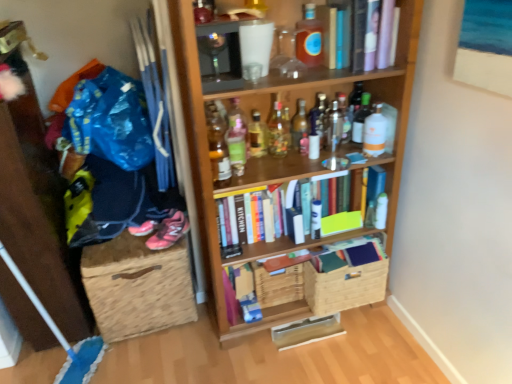
I want to click on translucent amber bottle at upper center, the sixth bottle when ordered from right to left, so click(x=310, y=38).

In order to click on clear glass bottle at center, the fifth bottle when ordered from right to left in this screenshot , I will do `click(318, 116)`.

What do you see at coordinates (241, 294) in the screenshot?
I see `hardcover book at center, the 1th book ordered from the bottom` at bounding box center [241, 294].

In order to face woven brown basket at lower center, the first basket when ordered from right to left, should I rotate leftwards or rightwards?

You should look right and rotate roughly 11.836 degrees.

Locate an element on the screen. This screenshot has width=512, height=384. clear glass bottle at upper center, placed as the 3th bottle when sorted from right to left is located at coordinates (344, 117).

Identify the location of translucent amber bottle at upper center, marked as the 6th bottle in a left-to-right arrangement. The image size is (512, 384). (310, 38).

Who is taller, clear glass bottle at center, the fifth bottle when ordered from right to left, or wooden crate at center, which is the second basket in right-to-left order?

wooden crate at center, which is the second basket in right-to-left order, is taller.

Is clear glass bottle at center, the fifth bottle when ordered from right to left, outside of wooden crate at center, which is the second basket in right-to-left order?

Yes, clear glass bottle at center, the fifth bottle when ordered from right to left, is outside of wooden crate at center, which is the second basket in right-to-left order.

Considering the relative sizes of clear glass bottle at center, the fifth bottle when ordered from right to left, and wooden crate at center, positioned as the 1th basket in left-to-right order, in the image provided, is clear glass bottle at center, the fifth bottle when ordered from right to left, wider than wooden crate at center, positioned as the 1th basket in left-to-right order,?

In fact, clear glass bottle at center, the fifth bottle when ordered from right to left, might be narrower than wooden crate at center, positioned as the 1th basket in left-to-right order.

What's the angular difference between hardcover books at center, the second book in the bottom-to-top sequence, and translucent plastic bottle at center, the 10th bottle from the right,'s facing directions?

1.1 degrees separate the facing orientations of hardcover books at center, the second book in the bottom-to-top sequence, and translucent plastic bottle at center, the 10th bottle from the right.

Would you consider hardcover books at center, the second book in the bottom-to-top sequence, to be distant from translucent plastic bottle at center, the 10th bottle from the right?

No, hardcover books at center, the second book in the bottom-to-top sequence, is in close proximity to translucent plastic bottle at center, the 10th bottle from the right.

Choose the correct answer: Is hardcover books at center, marked as the 2th book in a top-to-bottom arrangement, inside translucent plastic bottle at center, the 2th bottle in the left-to-right sequence, or outside it?

hardcover books at center, marked as the 2th book in a top-to-bottom arrangement, is not inside translucent plastic bottle at center, the 2th bottle in the left-to-right sequence, it's outside.

From the image's perspective, is hardcover books at center, marked as the 2th book in a top-to-bottom arrangement, positioned above or below translucent plastic bottle at center, the 2th bottle in the left-to-right sequence?

Clearly, from the image's perspective, hardcover books at center, marked as the 2th book in a top-to-bottom arrangement, is below translucent plastic bottle at center, the 2th bottle in the left-to-right sequence.

Is translucent glass bottle at center, which ranks as the first bottle in left-to-right order, located outside clear glass bottle at upper center, placed as the 3th bottle when sorted from right to left?

Yes, translucent glass bottle at center, which ranks as the first bottle in left-to-right order, is located beyond the bounds of clear glass bottle at upper center, placed as the 3th bottle when sorted from right to left.

Considering the sizes of objects translucent glass bottle at center, which ranks as the first bottle in left-to-right order, and clear glass bottle at upper center, which appears as the ninth bottle when viewed from the left, in the image provided, who is bigger, translucent glass bottle at center, which ranks as the first bottle in left-to-right order, or clear glass bottle at upper center, which appears as the ninth bottle when viewed from the left,?

translucent glass bottle at center, which ranks as the first bottle in left-to-right order, is bigger.

Is translucent glass bottle at center, which ranks as the first bottle in left-to-right order, oriented towards clear glass bottle at upper center, placed as the 3th bottle when sorted from right to left?

No, translucent glass bottle at center, which ranks as the first bottle in left-to-right order, is not facing towards clear glass bottle at upper center, placed as the 3th bottle when sorted from right to left.

Choose the correct answer: Is translucent amber bottle at upper center, marked as the 6th bottle in a left-to-right arrangement, inside woven brown basket at lower center, which is counted as the second basket, starting from the left, or outside it?

translucent amber bottle at upper center, marked as the 6th bottle in a left-to-right arrangement, exists outside the volume of woven brown basket at lower center, which is counted as the second basket, starting from the left.

Who is more distant, translucent amber bottle at upper center, marked as the 6th bottle in a left-to-right arrangement, or woven brown basket at lower center, which is counted as the second basket, starting from the left?

woven brown basket at lower center, which is counted as the second basket, starting from the left, is more distant.

Does translucent amber bottle at upper center, the sixth bottle when ordered from right to left, have a greater width compared to woven brown basket at lower center, which is counted as the second basket, starting from the left?

In fact, translucent amber bottle at upper center, the sixth bottle when ordered from right to left, might be narrower than woven brown basket at lower center, which is counted as the second basket, starting from the left.

Considering the positions of points (313, 65) and (326, 282), is point (313, 65) farther from camera compared to point (326, 282)?

No, it is not.

Is point (281, 138) less distant than point (265, 130)?

No, it is not.

Which bottle is the 1st one when counting from the right side of the translucent glass bottle at center, which appears as the 3th bottle when viewed from the left? Please provide its 2D coordinates.

[(278, 132)]

Considering the sizes of objects translucent glass bottle at center, positioned as the eighth bottle in right-to-left order, and translucent glass bottle at center, which appears as the 3th bottle when viewed from the left, in the image provided, who is taller, translucent glass bottle at center, positioned as the eighth bottle in right-to-left order, or translucent glass bottle at center, which appears as the 3th bottle when viewed from the left,?

translucent glass bottle at center, positioned as the eighth bottle in right-to-left order, is taller.

From the image's perspective, is translucent glass bottle at center, positioned as the eighth bottle in right-to-left order, beneath translucent glass bottle at center, positioned as the ninth bottle in right-to-left order?

No.

Would you say translucent plastic bottle at upper center, which is the 10th bottle from left to right, is outside clear glass bottle at center, which appears as the 4th bottle when viewed from the right?

Yes, translucent plastic bottle at upper center, which is the 10th bottle from left to right, is not within clear glass bottle at center, which appears as the 4th bottle when viewed from the right.

Does point (368, 93) lie in front of point (340, 139)?

No.

From the image's perspective, between translucent plastic bottle at upper center, which is the 10th bottle from left to right, and clear glass bottle at center, which appears as the 4th bottle when viewed from the right, who is located below?

From the image's view, clear glass bottle at center, which appears as the 4th bottle when viewed from the right, is below.

In the scene shown: Could you tell me if translucent glass bottle at center, arranged as the seventh bottle when viewed from the right, is turned towards blue fabric pants at left?

→ No, translucent glass bottle at center, arranged as the seventh bottle when viewed from the right, is not turned towards blue fabric pants at left.

Is translucent glass bottle at center, arranged as the seventh bottle when viewed from the right, in contact with blue fabric pants at left?

No, translucent glass bottle at center, arranged as the seventh bottle when viewed from the right, is not touching blue fabric pants at left.

Is the position of translucent glass bottle at center, placed as the fifth bottle when sorted from left to right, more distant than that of blue fabric pants at left?

Yes, it is behind blue fabric pants at left.

Looking at this image, between translucent glass bottle at center, arranged as the seventh bottle when viewed from the right, and blue fabric pants at left, which one has larger width?

blue fabric pants at left.

Where is `basket on the left of clear glass bottle at center, arranged as the 7th bottle when viewed from the left`? This screenshot has height=384, width=512. basket on the left of clear glass bottle at center, arranged as the 7th bottle when viewed from the left is located at coordinates (278, 285).

There is a translucent plastic bottle at center, the 2th bottle in the left-to-right sequence. At what (x,y) coordinates should I click in order to perform the action: click on the 1st book below it (from a real-world perspective). Please return your answer as a coordinate pair (x, y). Image resolution: width=512 pixels, height=384 pixels. Looking at the image, I should click on (321, 220).

Estimate the real-world distances between objects in this image. Which object is closer to translucent plastic bottle at upper center, which is the 10th bottle from left to right, blue fabric pants at left or translucent glass bottle at center, positioned as the eighth bottle in right-to-left order?

translucent glass bottle at center, positioned as the eighth bottle in right-to-left order, is positioned closer to the anchor translucent plastic bottle at upper center, which is the 10th bottle from left to right.

Looking at the image, which one is located further to woven brown basket at lower center, which is counted as the second basket, starting from the left, translucent glass bottle at upper center, which is the eleventh bottle from left to right, or translucent glass bottle at center, which ranks as the first bottle in left-to-right order?

Based on the image, translucent glass bottle at center, which ranks as the first bottle in left-to-right order, appears to be further to woven brown basket at lower center, which is counted as the second basket, starting from the left.

Looking at the image, which one is located further to clear glass bottle at upper center, placed as the 3th bottle when sorted from right to left, translucent glass bottle at upper center, which is the eleventh bottle from left to right, or translucent glass bottle at center, which ranks as the first bottle in left-to-right order?

The object further to clear glass bottle at upper center, placed as the 3th bottle when sorted from right to left, is translucent glass bottle at center, which ranks as the first bottle in left-to-right order.

Looking at the image, which one is located further to blue fabric pants at left, hardcover book at center, which is the third book in top-to-bottom order, or translucent glass bottle at center, placed as the fifth bottle when sorted from left to right?

translucent glass bottle at center, placed as the fifth bottle when sorted from left to right, is positioned further to the anchor blue fabric pants at left.

Based on their spatial positions, is clear glass bottle at center, the 8th bottle positioned from the left, or translucent glass bottle at center, placed as the fifth bottle when sorted from left to right, closer to wooden bookcase at center?

translucent glass bottle at center, placed as the fifth bottle when sorted from left to right, is positioned closer to the anchor wooden bookcase at center.

When comparing their distances from translucent glass bottle at upper center, which is the eleventh bottle from left to right, does hardcover book at upper center, marked as the 3th book in a bottom-to-top arrangement, or translucent amber bottle at upper center, marked as the 6th bottle in a left-to-right arrangement, seem closer?

The object closer to translucent glass bottle at upper center, which is the eleventh bottle from left to right, is hardcover book at upper center, marked as the 3th book in a bottom-to-top arrangement.

Looking at the image, which one is located further to clear glass bottle at center, the fifth bottle when ordered from right to left, clear glass bottle at upper center, placed as the 3th bottle when sorted from right to left, or burlap storage box at lower left?

burlap storage box at lower left is further to clear glass bottle at center, the fifth bottle when ordered from right to left.

Based on their spatial positions, is translucent glass bottle at center, arranged as the seventh bottle when viewed from the right, or hardcover book at upper center, marked as the 3th book in a bottom-to-top arrangement, further from clear glass bottle at center, the fifth bottle when ordered from right to left?

Based on the image, hardcover book at upper center, marked as the 3th book in a bottom-to-top arrangement, appears to be further to clear glass bottle at center, the fifth bottle when ordered from right to left.

The width and height of the screenshot is (512, 384). Find the location of `bottle between translucent glass bottle at center, positioned as the ninth bottle in right-to-left order, and translucent glass bottle at center, placed as the fifth bottle when sorted from left to right, from left to right`. bottle between translucent glass bottle at center, positioned as the ninth bottle in right-to-left order, and translucent glass bottle at center, placed as the fifth bottle when sorted from left to right, from left to right is located at coordinates (278, 132).

The width and height of the screenshot is (512, 384). Identify the location of footwear located between blue fabric pants at left and translucent glass bottle at center, positioned as the eighth bottle in right-to-left order, in the left-right direction. (169, 231).

This screenshot has width=512, height=384. In order to click on bookcase between pink mesh sneakers at lower left and hardcover books at center, marked as the 2th book in a top-to-bottom arrangement, in the horizontal direction in this screenshot , I will do `click(293, 179)`.

Find the location of a particular element. The width and height of the screenshot is (512, 384). footwear between translucent plastic bottle at center, the 2th bottle in the left-to-right sequence, and burlap storage box at lower left from top to bottom is located at coordinates (169, 231).